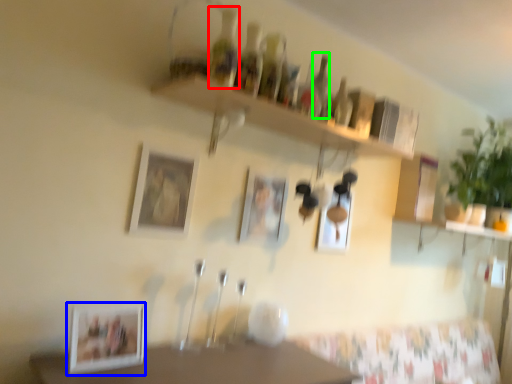
Question: Considering the real-world distances, which object is closest to bottle (highlighted by a red box)? picture frame (highlighted by a blue box) or bottle (highlighted by a green box).

Choices:
 (A) picture frame
 (B) bottle

Answer: (B)